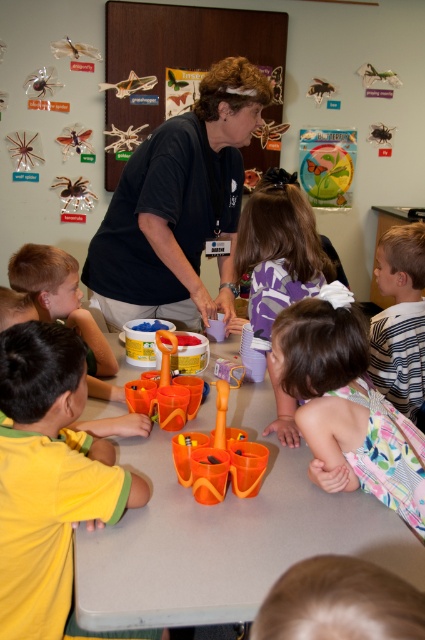
Based on the photo, can you confirm if plaid fabric dress at lower center is thinner than striped fabric shirt at right?

In fact, plaid fabric dress at lower center might be wider than striped fabric shirt at right.

Which is in front, point (314, 358) or point (394, 392)?

Point (314, 358) is more forward.

I want to click on plaid fabric dress at lower center, so click(x=348, y=406).

Locate an element on the screen. The image size is (425, 640). metallic silver insects at upper center is located at coordinates (184, 51).

Who is taller, metallic silver insects at upper center or blonde hair at lower center?

metallic silver insects at upper center

Which is behind, point (110, 22) or point (351, 563)?

The point (110, 22) is more distant.

At what (x,y) coordinates should I click in order to perform the action: click on metallic silver insects at upper center. Please return your answer as a coordinate pair (x, y). Looking at the image, I should click on (184, 51).

Is metallic silver insects at upper center smaller than translucent plastic toy at center?

No.

Where is `metallic silver insects at upper center`? metallic silver insects at upper center is located at coordinates (184, 51).